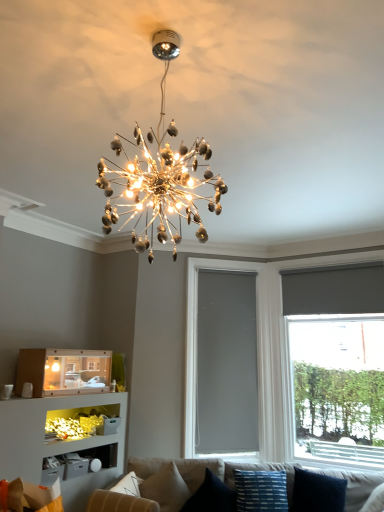
Question: Should I look upward or downward to see matte gray roller shade at right?

Choices:
 (A) up
 (B) down

Answer: (B)

Question: Is beige fabric couch at lower center positioned behind matte gray roller shade at right?

Choices:
 (A) no
 (B) yes

Answer: (A)

Question: Considering the relative positions of beige fabric couch at lower center and matte gray roller shade at right in the image provided, is beige fabric couch at lower center to the right of matte gray roller shade at right from the viewer's perspective?

Choices:
 (A) no
 (B) yes

Answer: (A)

Question: Does beige fabric couch at lower center appear on the left side of matte gray roller shade at right?

Choices:
 (A) yes
 (B) no

Answer: (A)

Question: From the image's perspective, is beige fabric couch at lower center above matte gray roller shade at right?

Choices:
 (A) no
 (B) yes

Answer: (A)

Question: Is there a large distance between beige fabric couch at lower center and matte gray roller shade at right?

Choices:
 (A) yes
 (B) no

Answer: (A)

Question: From a real-world perspective, is beige fabric couch at lower center over matte gray roller shade at right?

Choices:
 (A) no
 (B) yes

Answer: (A)

Question: Is beige fabric couch at lower center shorter than gray matte window screen at center?

Choices:
 (A) yes
 (B) no

Answer: (A)

Question: Would you say beige fabric couch at lower center is outside gray matte window screen at center?

Choices:
 (A) yes
 (B) no

Answer: (A)

Question: Can you confirm if beige fabric couch at lower center is taller than gray matte window screen at center?

Choices:
 (A) no
 (B) yes

Answer: (A)

Question: Can you confirm if beige fabric couch at lower center is smaller than gray matte window screen at center?

Choices:
 (A) no
 (B) yes

Answer: (A)

Question: Is gray matte window screen at center located within beige fabric couch at lower center?

Choices:
 (A) no
 (B) yes

Answer: (A)

Question: Can you confirm if beige fabric couch at lower center is positioned to the left of gray matte window screen at center?

Choices:
 (A) no
 (B) yes

Answer: (B)

Question: Can you confirm if matte gray roller shade at right is thinner than blue striped fabric pillow at lower center, which is counted as the 3th pillow, starting from the left?

Choices:
 (A) yes
 (B) no

Answer: (A)